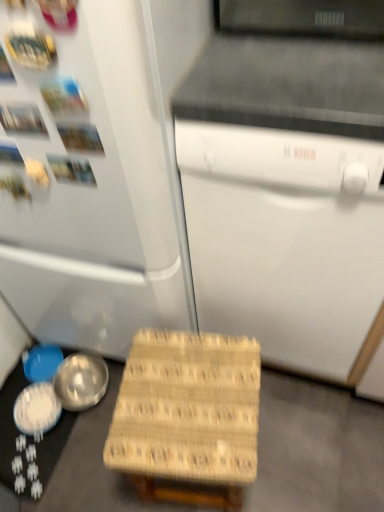
What do you see at coordinates (287, 196) in the screenshot? I see `white matte dishwasher at center` at bounding box center [287, 196].

Where is `white matte dishwasher at center`? The image size is (384, 512). white matte dishwasher at center is located at coordinates (287, 196).

Where is `woven wood step stool at lower center`? This screenshot has width=384, height=512. woven wood step stool at lower center is located at coordinates (188, 416).

The image size is (384, 512). Describe the element at coordinates (81, 381) in the screenshot. I see `shiny metallic bowl at lower left, the third bowl when ordered from left to right` at that location.

Find the location of a particular element. The image size is (384, 512). white matte dishwasher at center is located at coordinates (287, 196).

From a real-world perspective, is shiny silver bowl at lower left, positioned as the 2th bowl in right-to-left order, above or below white matte dishwasher at center?

In terms of real-world spatial position, shiny silver bowl at lower left, positioned as the 2th bowl in right-to-left order, is below white matte dishwasher at center.

Is point (33, 426) positioned before point (229, 236)?

No, (33, 426) is further to viewer.

How far apart are shiny silver bowl at lower left, positioned as the 2th bowl in right-to-left order, and white matte dishwasher at center?

shiny silver bowl at lower left, positioned as the 2th bowl in right-to-left order, and white matte dishwasher at center are 38.42 inches apart from each other.

Can you confirm if shiny silver bowl at lower left, positioned as the 2th bowl in right-to-left order, is thinner than white matte dishwasher at center?

Correct, the width of shiny silver bowl at lower left, positioned as the 2th bowl in right-to-left order, is less than that of white matte dishwasher at center.

Is white matte dishwasher at center to the right of woven wood step stool at lower center from the viewer's perspective?

Correct, you'll find white matte dishwasher at center to the right of woven wood step stool at lower center.

The height and width of the screenshot is (512, 384). Identify the location of appliance lying above the woven wood step stool at lower center (from the image's perspective). (287, 196).

From the image's perspective, is white matte dishwasher at center over woven wood step stool at lower center?

Yes.

From a real-world perspective, between blue matte bowl at lower left, acting as the 1th bowl starting from the left, and shiny metallic bowl at lower left, which is the 1th bowl from right to left, who is vertically higher?

shiny metallic bowl at lower left, which is the 1th bowl from right to left, is physically above.

Who is shorter, blue matte bowl at lower left, acting as the 1th bowl starting from the left, or shiny metallic bowl at lower left, the third bowl when ordered from left to right?

Standing shorter between the two is blue matte bowl at lower left, acting as the 1th bowl starting from the left.

Image resolution: width=384 pixels, height=512 pixels. Identify the location of the 1st bowl below the blue matte bowl at lower left, acting as the 3th bowl starting from the right (from the image's perspective). (81, 381).

Based on the photo, is blue matte bowl at lower left, acting as the 3th bowl starting from the right, to the left or to the right of shiny metallic bowl at lower left, the third bowl when ordered from left to right, in the image?

Based on their positions, blue matte bowl at lower left, acting as the 3th bowl starting from the right, is located to the left of shiny metallic bowl at lower left, the third bowl when ordered from left to right.

Is woven wood step stool at lower center oriented towards shiny silver bowl at lower left, the 2th bowl from the left?

No.

Considering the sizes of woven wood step stool at lower center and shiny silver bowl at lower left, positioned as the 2th bowl in right-to-left order, in the image, is woven wood step stool at lower center taller or shorter than shiny silver bowl at lower left, positioned as the 2th bowl in right-to-left order,?

Clearly, woven wood step stool at lower center is taller compared to shiny silver bowl at lower left, positioned as the 2th bowl in right-to-left order.

What's the angular difference between woven wood step stool at lower center and shiny silver bowl at lower left, the 2th bowl from the left,'s facing directions?

woven wood step stool at lower center and shiny silver bowl at lower left, the 2th bowl from the left, are facing 81.4 degrees away from each other.

Considering the relative sizes of woven wood step stool at lower center and shiny silver bowl at lower left, positioned as the 2th bowl in right-to-left order, in the image provided, is woven wood step stool at lower center wider than shiny silver bowl at lower left, positioned as the 2th bowl in right-to-left order,?

Yes, woven wood step stool at lower center is wider than shiny silver bowl at lower left, positioned as the 2th bowl in right-to-left order.

Between blue matte bowl at lower left, acting as the 3th bowl starting from the right, and white matte dishwasher at center, which one has smaller size?

Smaller between the two is blue matte bowl at lower left, acting as the 3th bowl starting from the right.

Is blue matte bowl at lower left, acting as the 3th bowl starting from the right, at the right side of white matte dishwasher at center?

No.

In the scene shown: Who is taller, blue matte bowl at lower left, acting as the 1th bowl starting from the left, or white matte dishwasher at center?

white matte dishwasher at center is taller.

Does point (43, 358) come closer to viewer compared to point (239, 65)?

No, (43, 358) is further to viewer.

Between white matte dishwasher at center and blue matte bowl at lower left, acting as the 1th bowl starting from the left, which one appears on the right side from the viewer's perspective?

white matte dishwasher at center is more to the right.

From the picture: From a real-world perspective, is white matte dishwasher at center located higher than blue matte bowl at lower left, acting as the 3th bowl starting from the right?

Indeed, from a real-world perspective, white matte dishwasher at center stands above blue matte bowl at lower left, acting as the 3th bowl starting from the right.

Is there a large distance between white matte dishwasher at center and blue matte bowl at lower left, acting as the 1th bowl starting from the left?

Indeed, white matte dishwasher at center is not near blue matte bowl at lower left, acting as the 1th bowl starting from the left.

Is blue matte bowl at lower left, acting as the 1th bowl starting from the left, surrounding shiny silver bowl at lower left, positioned as the 2th bowl in right-to-left order?

No, shiny silver bowl at lower left, positioned as the 2th bowl in right-to-left order, is not a part of blue matte bowl at lower left, acting as the 1th bowl starting from the left.

Starting from the blue matte bowl at lower left, acting as the 3th bowl starting from the right, which bowl is the 2nd one in front? Please provide its 2D coordinates.

[(37, 409)]

Looking at the image, does blue matte bowl at lower left, acting as the 1th bowl starting from the left, seem bigger or smaller compared to shiny silver bowl at lower left, the 2th bowl from the left?

blue matte bowl at lower left, acting as the 1th bowl starting from the left, is smaller than shiny silver bowl at lower left, the 2th bowl from the left.

There is a white matte dishwasher at center. Identify the location of the 3rd bowl below it (from the image's perspective). Image resolution: width=384 pixels, height=512 pixels. (37, 409).

Find the location of a particular element. appliance above the woven wood step stool at lower center (from the image's perspective) is located at coordinates (287, 196).

Looking at the image, which one is located further to woven wood step stool at lower center, blue matte bowl at lower left, acting as the 3th bowl starting from the right, or shiny metallic bowl at lower left, which is the 1th bowl from right to left?

The object further to woven wood step stool at lower center is blue matte bowl at lower left, acting as the 3th bowl starting from the right.

Which object lies further to the anchor point shiny metallic bowl at lower left, the third bowl when ordered from left to right, white matte dishwasher at center or white matte refrigerator at left?

white matte dishwasher at center lies further to shiny metallic bowl at lower left, the third bowl when ordered from left to right, than the other object.

When comparing their distances from white matte dishwasher at center, does shiny metallic bowl at lower left, the third bowl when ordered from left to right, or white matte refrigerator at left seem further?

The object further to white matte dishwasher at center is shiny metallic bowl at lower left, the third bowl when ordered from left to right.

Based on their spatial positions, is blue matte bowl at lower left, acting as the 3th bowl starting from the right, or white matte dishwasher at center further from shiny silver bowl at lower left, the 2th bowl from the left?

white matte dishwasher at center is positioned further to the anchor shiny silver bowl at lower left, the 2th bowl from the left.

When comparing their distances from shiny metallic bowl at lower left, which is the 1th bowl from right to left, does woven wood step stool at lower center or white matte dishwasher at center seem closer?

woven wood step stool at lower center lies closer to shiny metallic bowl at lower left, which is the 1th bowl from right to left, than the other object.

Based on their spatial positions, is woven wood step stool at lower center or white matte refrigerator at left closer to shiny metallic bowl at lower left, the third bowl when ordered from left to right?

woven wood step stool at lower center is closer to shiny metallic bowl at lower left, the third bowl when ordered from left to right.

From the image, which object appears to be nearer to white matte dishwasher at center, white matte refrigerator at left or woven wood step stool at lower center?

The object closer to white matte dishwasher at center is white matte refrigerator at left.

From the image, which object appears to be farther from shiny silver bowl at lower left, the 2th bowl from the left, blue matte bowl at lower left, acting as the 1th bowl starting from the left, or white matte refrigerator at left?

The object further to shiny silver bowl at lower left, the 2th bowl from the left, is white matte refrigerator at left.

Image resolution: width=384 pixels, height=512 pixels. I want to click on step stool between white matte refrigerator at left and blue matte bowl at lower left, acting as the 1th bowl starting from the left, in the front-back direction, so click(188, 416).

Identify the location of bowl between blue matte bowl at lower left, acting as the 1th bowl starting from the left, and shiny metallic bowl at lower left, the third bowl when ordered from left to right, in the horizontal direction. (37, 409).

Locate an element on the screen. This screenshot has width=384, height=512. step stool between white matte refrigerator at left and shiny silver bowl at lower left, the 2th bowl from the left, in the vertical direction is located at coordinates (188, 416).

Find the location of a particular element. This screenshot has height=512, width=384. appliance between white matte refrigerator at left and blue matte bowl at lower left, acting as the 1th bowl starting from the left, from front to back is located at coordinates (287, 196).